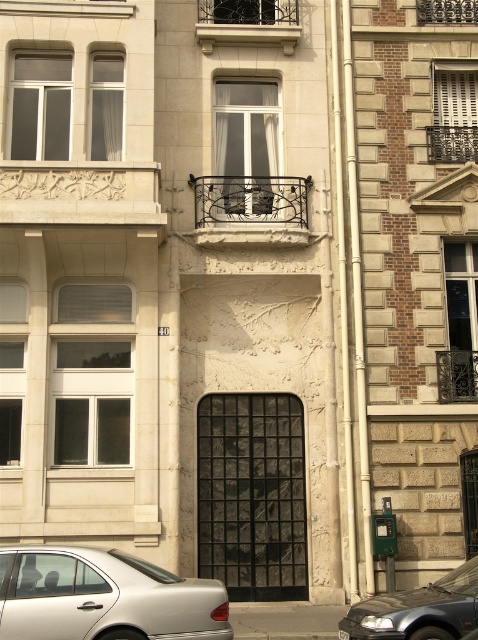
You are standing in front of the multi story classical building. You see a point at coordinate (248, 22). What object is located at that point?

The point at coordinate (248, 22) corresponds to the black wrought iron balcony at upper center.

You are standing at the entrance of the building and looking up at the facade. There is a black wrought iron balcony at upper center. Can you estimate the coordinates of the balcony relative to the building facade?

The coordinates of the black wrought iron balcony at upper center are at point (248, 22) relative to the building facade.

You are a delivery person standing next to the silver metallic car at lower left and need to deliver a package to the wrought iron balcony at center. The package requires a ladder that can reach up to 10 meters. Do you think the ladder will be sufficient to reach the balcony from the car?

The silver metallic car at lower left and wrought iron balcony at center are 10.19 meters apart, so the ladder that can reach up to 10 meters may not be sufficient because the distance is slightly longer than the ladder can reach.